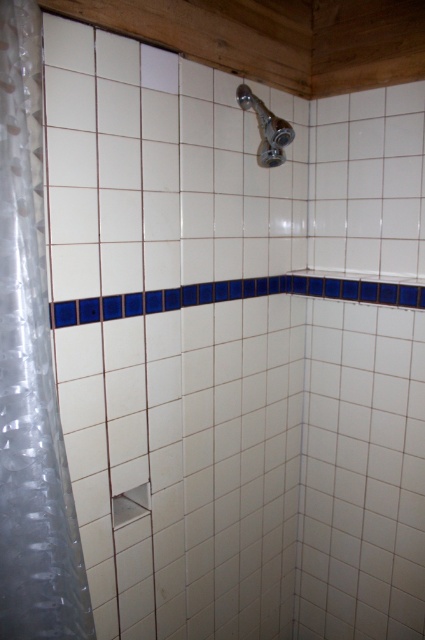
You are a contractor installing a new showerhead. You need to ensure that the showerhead is placed above the shower curtain to avoid water splashing onto the floor. Is the satin chrome showerhead at upper center positioned correctly over the clear plastic shower curtain at left?

The clear plastic shower curtain at left is positioned under the satin chrome showerhead at upper center, so the showerhead is correctly placed above the shower curtain to prevent water from splashing onto the floor.

You are designing a bathroom layout and need to ensure that the clear plastic shower curtain at left can fully cover the satin chrome showerhead at upper center when closed. Based on the provided image, will the shower curtain be wide enough to cover the showerhead?

The clear plastic shower curtain at left has a width less than the satin chrome showerhead at upper center, so it will not be wide enough to fully cover the showerhead when closed.

You are standing in the shower area and want to ensure the shower curtain doesn not hit the showerhead when fully extended. Based on the scene description, will the clear plastic shower curtain at left reach the height of the satin chrome showerhead at upper center?

The clear plastic shower curtain at left has a greater height compared to the satin chrome showerhead at upper center, so when fully extended, the shower curtain will reach and potentially hit the showerhead.